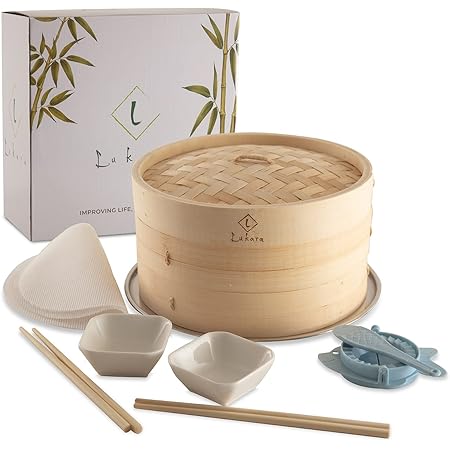
Locate an element on the screen. The height and width of the screenshot is (450, 450). base of bowl is located at coordinates (128, 376).